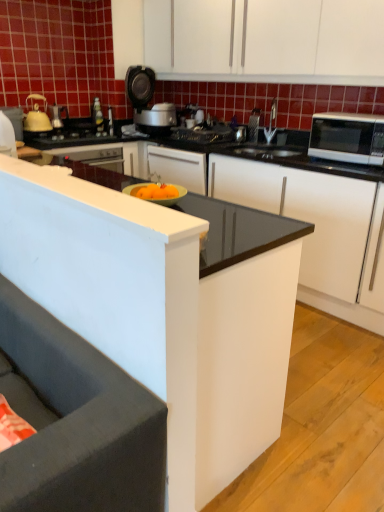
Question: Is white matte cabinet at upper center, the 2th cabinetry when ordered from bottom to top, facing away from white glossy cabinet at center, the 1th cabinetry ordered from the bottom?

Choices:
 (A) no
 (B) yes

Answer: (A)

Question: Is white matte cabinet at upper center, acting as the 1th cabinetry starting from the top, smaller than white glossy cabinet at center, the 1th cabinetry ordered from the bottom?

Choices:
 (A) yes
 (B) no

Answer: (A)

Question: Does white matte cabinet at upper center, acting as the 1th cabinetry starting from the top, have a lesser width compared to white glossy cabinet at center, the 2th cabinetry in the top-to-bottom sequence?

Choices:
 (A) no
 (B) yes

Answer: (B)

Question: Is white matte cabinet at upper center, the 2th cabinetry when ordered from bottom to top, positioned far away from white glossy cabinet at center, the 1th cabinetry ordered from the bottom?

Choices:
 (A) yes
 (B) no

Answer: (A)

Question: Does white matte cabinet at upper center, the 2th cabinetry when ordered from bottom to top, appear on the right side of white glossy cabinet at center, the 2th cabinetry in the top-to-bottom sequence?

Choices:
 (A) no
 (B) yes

Answer: (B)

Question: Looking at the image, does white glossy cabinet at center, the 1th cabinetry ordered from the bottom, seem bigger or smaller compared to metallic silver toaster at upper center?

Choices:
 (A) small
 (B) big

Answer: (B)

Question: Is white glossy cabinet at center, the 2th cabinetry in the top-to-bottom sequence, inside the boundaries of metallic silver toaster at upper center, or outside?

Choices:
 (A) inside
 (B) outside

Answer: (B)

Question: Is white glossy cabinet at center, the 1th cabinetry ordered from the bottom, wider or thinner than metallic silver toaster at upper center?

Choices:
 (A) thin
 (B) wide

Answer: (B)

Question: From the image's perspective, relative to metallic silver toaster at upper center, is white glossy cabinet at center, the 2th cabinetry in the top-to-bottom sequence, above or below?

Choices:
 (A) above
 (B) below

Answer: (B)

Question: Would you say white glossy microwave at right is inside or outside black glossy counter at center?

Choices:
 (A) outside
 (B) inside

Answer: (B)

Question: From the image's perspective, is white glossy microwave at right above or below black glossy counter at center?

Choices:
 (A) above
 (B) below

Answer: (A)

Question: Considering the positions of point (362, 143) and point (291, 193), is point (362, 143) closer or farther from the camera than point (291, 193)?

Choices:
 (A) closer
 (B) farther

Answer: (A)

Question: Is white glossy microwave at right taller or shorter than black glossy counter at center?

Choices:
 (A) short
 (B) tall

Answer: (A)

Question: Is white glossy microwave at right inside or outside of dark gray fabric studio couch at lower left?

Choices:
 (A) outside
 (B) inside

Answer: (A)

Question: Relative to dark gray fabric studio couch at lower left, is white glossy microwave at right in front or behind?

Choices:
 (A) behind
 (B) front

Answer: (A)